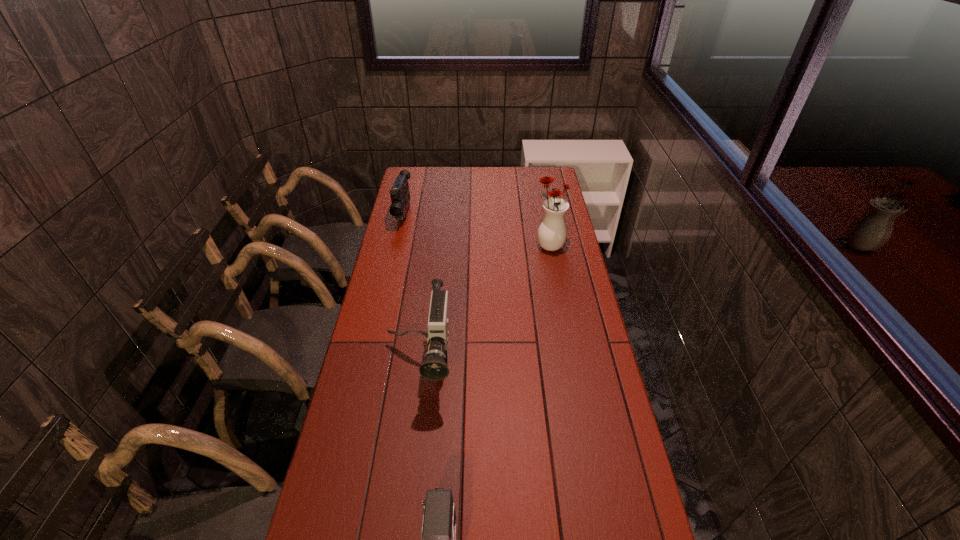
Where is `free space between the leftmost object and the third farthest object`? free space between the leftmost object and the third farthest object is located at coordinates pyautogui.click(x=412, y=289).

Identify which object is the third nearest to the leftmost object. Please provide its 2D coordinates. Your answer should be formatted as a tuple, i.e. [(x, y)], where the tuple contains the x and y coordinates of a point satisfying the conditions above.

[(438, 535)]

Select which object is the second closest to the second farthest object. Please provide its 2D coordinates. Your answer should be formatted as a tuple, i.e. [(x, y)], where the tuple contains the x and y coordinates of a point satisfying the conditions above.

[(400, 195)]

You are a GUI agent. You are given a task and a screenshot of the screen. Output one action in this format:
    pyautogui.click(x=<x>, y=<y>)
    Task: Click on the closest camcorder relative to the farthest object
    The image size is (960, 540).
    Given the screenshot: What is the action you would take?
    coord(434,367)

The image size is (960, 540). Find the location of `camcorder that can be found as the closest to the farthest camcorder`. camcorder that can be found as the closest to the farthest camcorder is located at coordinates (434, 367).

The width and height of the screenshot is (960, 540). What are the coordinates of `free space that satisfies the following two spatial constraints: 1. on the front-facing side of the vase; 2. on the right side of the farthest object` in the screenshot? It's located at (396, 246).

Identify the location of free space that satisfies the following two spatial constraints: 1. on the front-facing side of the vase; 2. on the right side of the leftmost object. This screenshot has height=540, width=960. (396, 246).

Image resolution: width=960 pixels, height=540 pixels. I want to click on free space that satisfies the following two spatial constraints: 1. on the front-facing side of the leftmost camcorder; 2. on the left side of the tallest object, so click(396, 246).